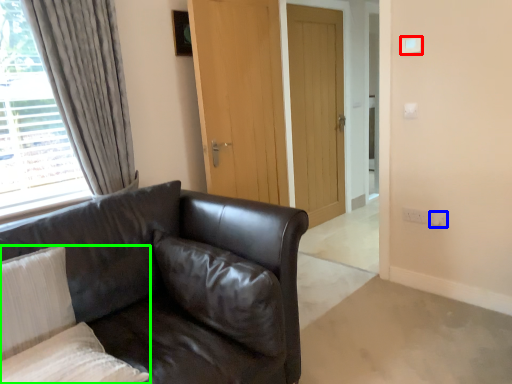
Question: Which object is positioned closest to light switch (highlighted by a red box)? Select from electric outlet (highlighted by a blue box) and pillow (highlighted by a green box).

Choices:
 (A) electric outlet
 (B) pillow

Answer: (A)